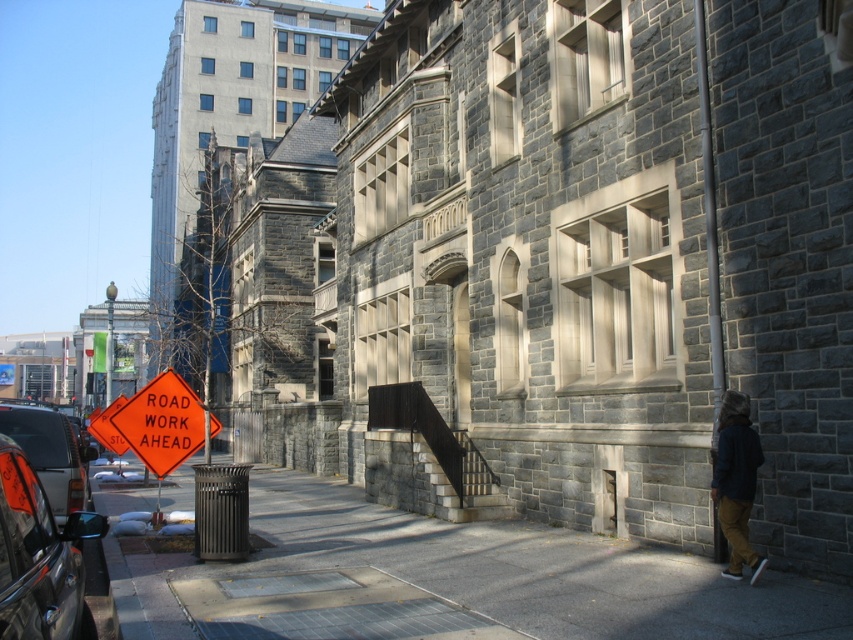
Question: Is dark blue jacket at lower right bigger than matte black car at left?

Choices:
 (A) yes
 (B) no

Answer: (B)

Question: Which of these objects is positioned closest to the shiny black car at left?

Choices:
 (A) orange plastic sign at lower left
 (B) smooth concrete pavement at lower center
 (C) matte black car at left
 (D) dark blue jacket at lower right

Answer: (C)

Question: Which point is farther to the camera?

Choices:
 (A) (19, 492)
 (B) (173, 460)
 (C) (723, 474)

Answer: (B)

Question: Can you confirm if shiny black car at left is thinner than orange plastic sign at lower left?

Choices:
 (A) yes
 (B) no

Answer: (A)

Question: Which object is the closest to the smooth concrete pavement at lower center?

Choices:
 (A) matte black car at left
 (B) orange plastic sign at lower left

Answer: (B)

Question: Is shiny black car at left wider than dark blue jacket at lower right?

Choices:
 (A) yes
 (B) no

Answer: (A)